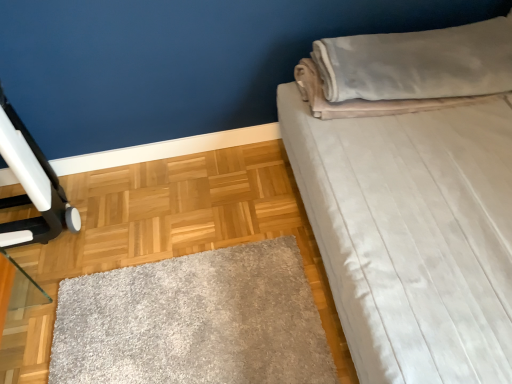
Question: Does velvet beige pillow at upper right touch white soft bed at upper right?

Choices:
 (A) yes
 (B) no

Answer: (B)

Question: Can you confirm if velvet beige pillow at upper right is taller than white soft bed at upper right?

Choices:
 (A) no
 (B) yes

Answer: (A)

Question: Would you say velvet beige pillow at upper right is a long distance from white soft bed at upper right?

Choices:
 (A) no
 (B) yes

Answer: (A)

Question: Is velvet beige pillow at upper right oriented away from white soft bed at upper right?

Choices:
 (A) no
 (B) yes

Answer: (B)

Question: From a real-world perspective, is velvet beige pillow at upper right on white soft bed at upper right?

Choices:
 (A) yes
 (B) no

Answer: (B)

Question: Considering the relative positions of velvet beige pillow at upper right and white soft bed at upper right in the image provided, is velvet beige pillow at upper right to the left of white soft bed at upper right from the viewer's perspective?

Choices:
 (A) yes
 (B) no

Answer: (A)

Question: From a real-world perspective, is white soft bed at upper right beneath velvet beige pillow at upper right?

Choices:
 (A) yes
 (B) no

Answer: (B)

Question: Does white soft bed at upper right lie behind velvet beige pillow at upper right?

Choices:
 (A) yes
 (B) no

Answer: (B)

Question: Is white soft bed at upper right positioned with its back to velvet beige pillow at upper right?

Choices:
 (A) yes
 (B) no

Answer: (A)

Question: From the image's perspective, is white soft bed at upper right located beneath velvet beige pillow at upper right?

Choices:
 (A) yes
 (B) no

Answer: (A)

Question: From a real-world perspective, is white soft bed at upper right on velvet beige pillow at upper right?

Choices:
 (A) no
 (B) yes

Answer: (B)

Question: Is white soft bed at upper right not inside velvet beige pillow at upper right?

Choices:
 (A) yes
 (B) no

Answer: (A)

Question: From the image's perspective, relative to white soft bed at upper right, is velvet beige pillow at upper right above or below?

Choices:
 (A) above
 (B) below

Answer: (A)